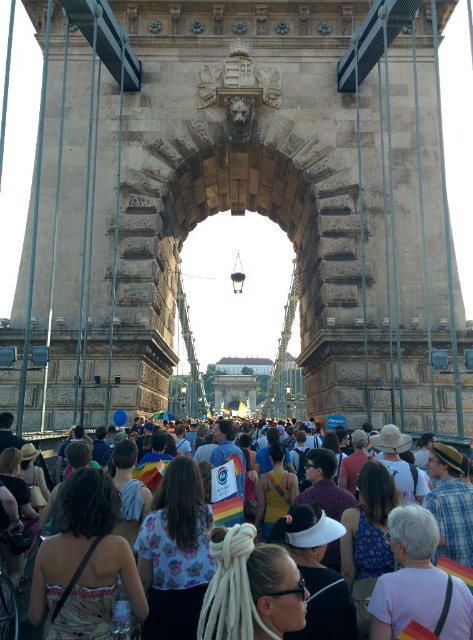
Question: Among these points, which one is farthest from the camera?

Choices:
 (A) (472, 596)
 (B) (222, 44)

Answer: (B)

Question: Observing the image, what is the correct spatial positioning of floral fabric shirt at center in reference to white matte visor at center?

Choices:
 (A) left
 (B) right

Answer: (A)

Question: Which point appears farthest from the camera in this image?

Choices:
 (A) (24, 602)
 (B) (281, 449)

Answer: (B)

Question: Which point is closer to the camera?

Choices:
 (A) floral fabric shirt at center
 (B) stone archway at center

Answer: (A)

Question: Is floral fabric shirt at center thinner than white matte visor at center?

Choices:
 (A) no
 (B) yes

Answer: (A)

Question: Is printed fabric dress at center positioned before plaid fabric shirt at center-right?

Choices:
 (A) no
 (B) yes

Answer: (B)